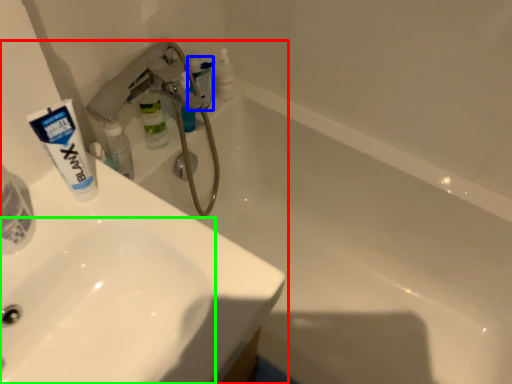
Question: Based on their relative distances, which object is nearer to sink (highlighted by a red box)? Choose from toiletry (highlighted by a blue box) and sink (highlighted by a green box).

Choices:
 (A) toiletry
 (B) sink

Answer: (B)